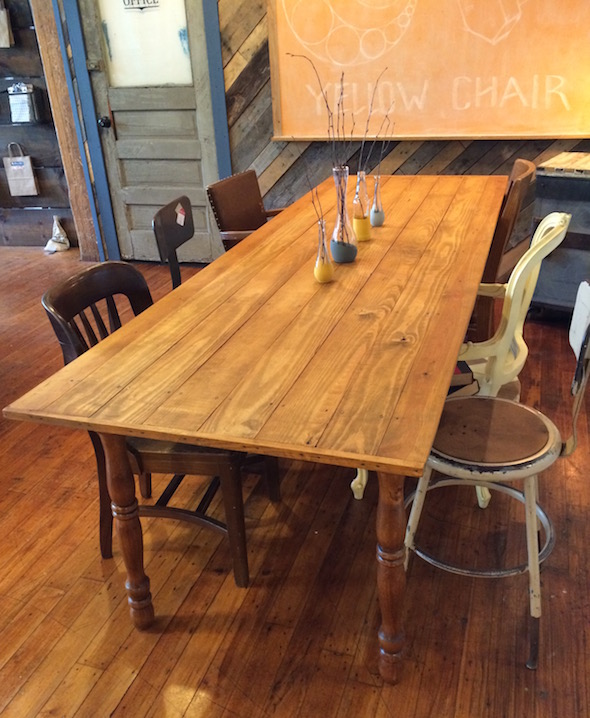
Locate an element on the screen. Image resolution: width=590 pixels, height=718 pixels. 2 drawer cabinet is located at coordinates click(573, 186), click(569, 256).